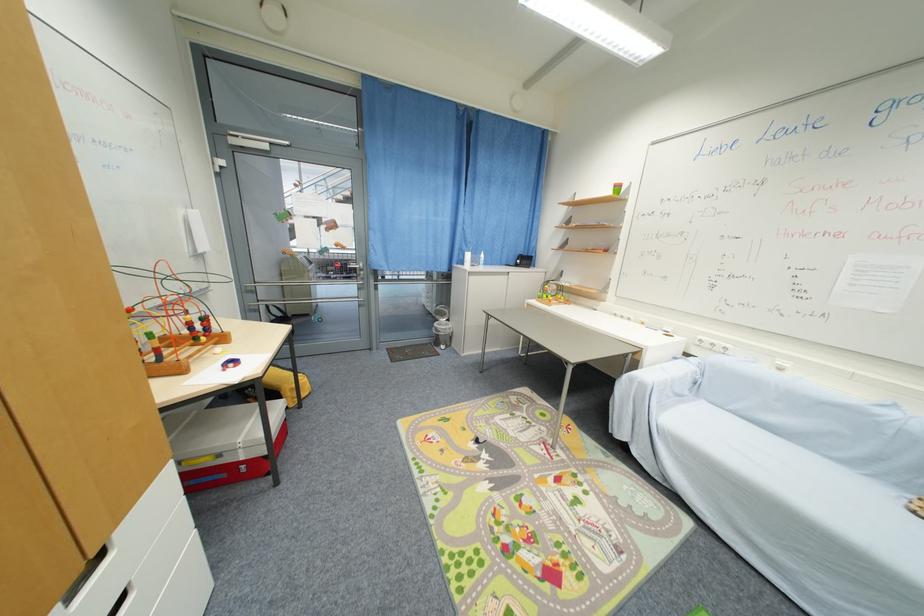
Where would you play the toy bead maze? Please return your answer as a coordinate pair (x, y).

(172, 318)